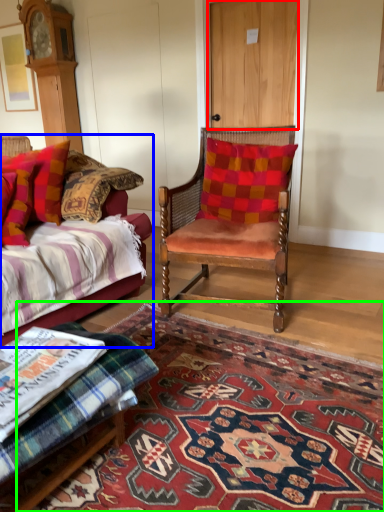
Question: Which object is the farthest from door (highlighted by a red box)? Choose among these: studio couch (highlighted by a blue box) or mat (highlighted by a green box).

Choices:
 (A) studio couch
 (B) mat

Answer: (B)